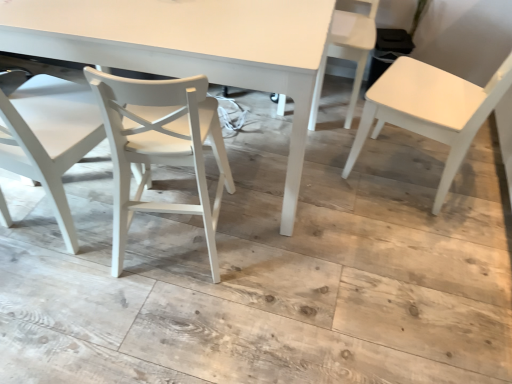
The width and height of the screenshot is (512, 384). What are the coordinates of `space that is in front of white plastic chair at upper right, the 2th chair from the right` in the screenshot? It's located at (288, 140).